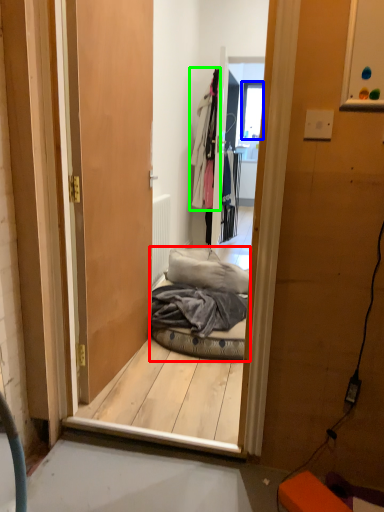
Question: Estimate the real-world distances between objects in this image. Which object is closer to bed (highlighted by a red box), window (highlighted by a blue box) or clothing (highlighted by a green box)?

Choices:
 (A) window
 (B) clothing

Answer: (B)